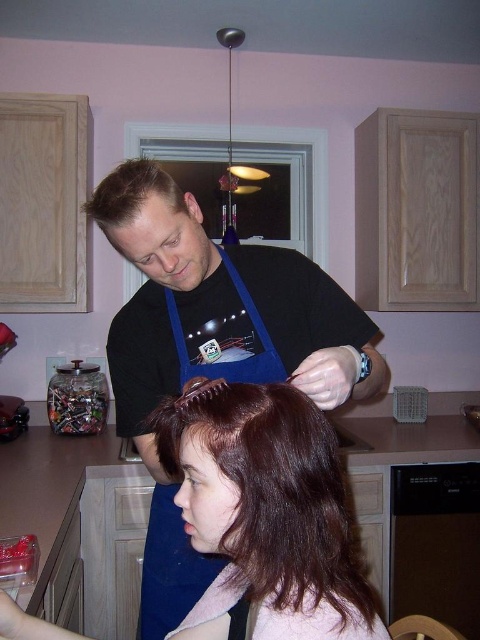
Question: Is dark brown silky hair at lower center wider than blue fabric apron at center?

Choices:
 (A) yes
 (B) no

Answer: (A)

Question: Which of the following is the farthest from the observer?

Choices:
 (A) coord(263,380)
 (B) coord(212,497)
 (C) coord(142,216)

Answer: (A)

Question: Which of these objects is positioned closest to the blue apron at center?

Choices:
 (A) dark brown silky hair at lower center
 (B) blue fabric apron at center

Answer: (A)

Question: Can you confirm if blue apron at center is positioned to the right of dark brown silky hair at lower center?

Choices:
 (A) yes
 (B) no

Answer: (B)

Question: Which point is closer to the camera?

Choices:
 (A) (247, 305)
 (B) (301, 477)

Answer: (B)

Question: Does dark brown silky hair at lower center come behind blue fabric apron at center?

Choices:
 (A) yes
 (B) no

Answer: (B)